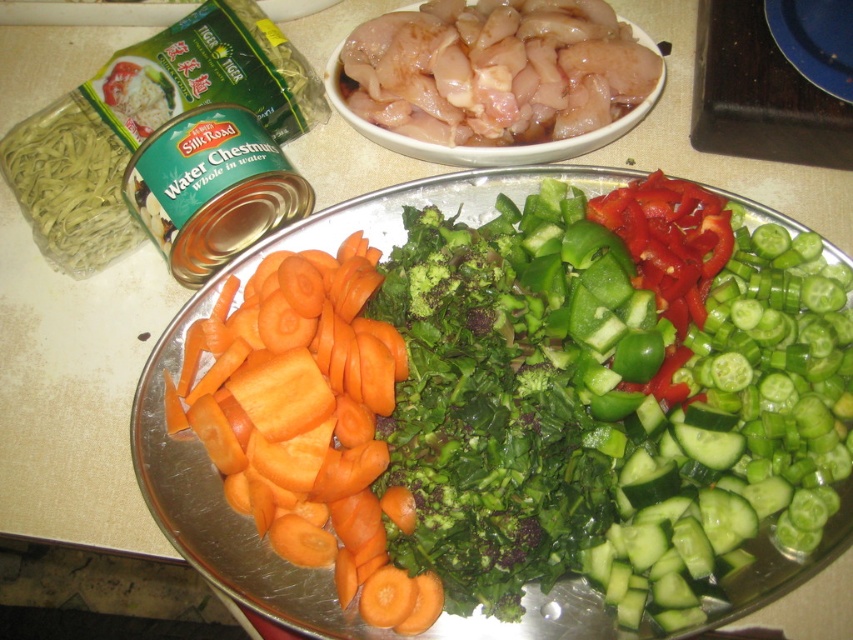
Question: Considering the relative positions of orange smooth carrot at center-left and pale pink glossy chicken at upper center in the image provided, where is orange smooth carrot at center-left located with respect to pale pink glossy chicken at upper center?

Choices:
 (A) right
 (B) left

Answer: (B)

Question: Does green smooth cucumber at center have a lesser width compared to green leafy broccoli at center?

Choices:
 (A) no
 (B) yes

Answer: (A)

Question: Which object appears farthest from the camera in this image?

Choices:
 (A) orange smooth carrot at center-left
 (B) green leafy broccoli at center
 (C) green smooth cucumber at center
 (D) pale pink glossy chicken at upper center

Answer: (D)

Question: Which point is closer to the camera?

Choices:
 (A) (734, 248)
 (B) (416, 292)
 (C) (252, 506)
 (D) (612, 17)

Answer: (C)

Question: Which is farther from the orange smooth carrot at center-left?

Choices:
 (A) green smooth cucumber at center
 (B) pale pink glossy chicken at upper center

Answer: (B)

Question: Is green smooth cucumber at center to the right of orange smooth carrot at center-left from the viewer's perspective?

Choices:
 (A) yes
 (B) no

Answer: (A)